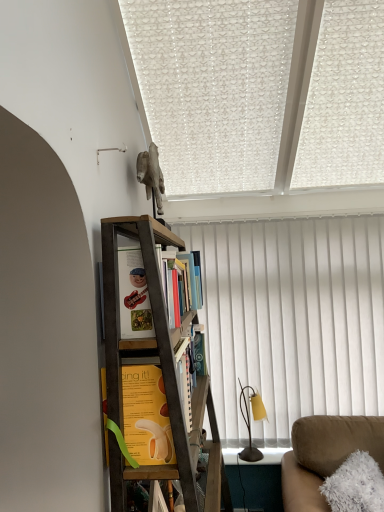
In order to face suede couch at lower right, should I rotate leftwards or rightwards?

Turn right approximately 23.073 degrees to face it.

The height and width of the screenshot is (512, 384). What do you see at coordinates (142, 356) in the screenshot? I see `wooden bookcase at center` at bounding box center [142, 356].

What do you see at coordinates (249, 424) in the screenshot? The image size is (384, 512). I see `metallic yellow table lamp at right` at bounding box center [249, 424].

Find the location of `yellow paper at center, arranged as the first book when ordered from the bottom`. yellow paper at center, arranged as the first book when ordered from the bottom is located at coordinates (146, 416).

What is the approximate width of gray stone horse at upper center?

gray stone horse at upper center is 5.29 inches wide.

The image size is (384, 512). I want to click on white textured curtain at center, so click(292, 319).

Can you confirm if gray stone horse at upper center is positioned to the left of hardcover books at center, acting as the 2th book starting from the front?

Indeed, gray stone horse at upper center is positioned on the left side of hardcover books at center, acting as the 2th book starting from the front.

From a real-world perspective, is gray stone horse at upper center on hardcover books at center, the 1th book positioned from the top?

Yes, from a real-world perspective, gray stone horse at upper center is over hardcover books at center, the 1th book positioned from the top

Find the location of a particular element. The width and height of the screenshot is (384, 512). animal on the left of hardcover books at center, the 1th book positioned from the top is located at coordinates (151, 174).

Consider the image. Does gray stone horse at upper center have a smaller size compared to hardcover books at center, placed as the second book when sorted from bottom to top?

No, gray stone horse at upper center is not smaller than hardcover books at center, placed as the second book when sorted from bottom to top.

Considering the points (202, 397) and (152, 142), which point is in front, point (202, 397) or point (152, 142)?

The point (202, 397) is more forward.

Would you say wooden bookcase at center is outside gray stone horse at upper center?

Absolutely, wooden bookcase at center is external to gray stone horse at upper center.

Locate an element on the screen. The image size is (384, 512). animal located above the wooden bookcase at center (from a real-world perspective) is located at coordinates (151, 174).

From the image's perspective, which object appears higher, wooden bookcase at center or gray stone horse at upper center?

gray stone horse at upper center appears higher in the image.

Is wooden bookshelf at upper center in contact with suede couch at lower right?

No, wooden bookshelf at upper center is not making contact with suede couch at lower right.

From a real-world perspective, is wooden bookshelf at upper center on top of suede couch at lower right?

Yes, from a real-world perspective, wooden bookshelf at upper center is over suede couch at lower right

You are a GUI agent. You are given a task and a screenshot of the screen. Output one action in this format:
    pyautogui.click(x=<x>, y=<y>)
    Task: Click on the studio couch below the wooden bookshelf at upper center (from a real-world perspective)
    
    Given the screenshot: What is the action you would take?
    pyautogui.click(x=325, y=455)

Considering the relative positions of wooden bookshelf at upper center and suede couch at lower right in the image provided, is wooden bookshelf at upper center to the left of suede couch at lower right from the viewer's perspective?

Indeed, wooden bookshelf at upper center is positioned on the left side of suede couch at lower right.

Locate an element on the screen. Image resolution: width=384 pixels, height=512 pixels. animal in front of the metallic yellow table lamp at right is located at coordinates (151, 174).

Is metallic yellow table lamp at right positioned far away from gray stone horse at upper center?

Indeed, metallic yellow table lamp at right is not near gray stone horse at upper center.

Between metallic yellow table lamp at right and gray stone horse at upper center, which one has less height?

gray stone horse at upper center is shorter.

Considering the positions of objects metallic yellow table lamp at right and gray stone horse at upper center in the image provided, who is more to the right, metallic yellow table lamp at right or gray stone horse at upper center?

From the viewer's perspective, metallic yellow table lamp at right appears more on the right side.

Could you tell me if yellow paper at center, which is the 2th book in back-to-front order, is facing wooden bookcase at center?

Yes, yellow paper at center, which is the 2th book in back-to-front order, is facing wooden bookcase at center.

Is yellow paper at center, arranged as the first book when ordered from the bottom, not close to wooden bookcase at center?

No, yellow paper at center, arranged as the first book when ordered from the bottom, is not far away from wooden bookcase at center.

Would you say yellow paper at center, which appears as the first book when viewed from the front, is to the left or to the right of wooden bookcase at center in the picture?

yellow paper at center, which appears as the first book when viewed from the front, is positioned on wooden bookcase at center's left side.

The height and width of the screenshot is (512, 384). What are the coordinates of `book that appears behind the wooden bookshelf at upper center` in the screenshot? It's located at (192, 277).

Is hardcover books at center, acting as the 2th book starting from the front, located within wooden bookshelf at upper center?

No, hardcover books at center, acting as the 2th book starting from the front, is located outside of wooden bookshelf at upper center.

From the image's perspective, which is below, wooden bookshelf at upper center or hardcover books at center, the 1th book positioned from the top?

hardcover books at center, the 1th book positioned from the top, is shown below in the image.

Considering the sizes of objects wooden bookshelf at upper center and hardcover books at center, acting as the 2th book starting from the front, in the image provided, who is smaller, wooden bookshelf at upper center or hardcover books at center, acting as the 2th book starting from the front,?

wooden bookshelf at upper center.

From a real-world perspective, between wooden bookshelf at upper center and gray stone horse at upper center, who is vertically higher?

gray stone horse at upper center is physically above.

Find the location of a particular element. animal behind the wooden bookshelf at upper center is located at coordinates (151, 174).

From the image's perspective, is wooden bookshelf at upper center under gray stone horse at upper center?

Correct, wooden bookshelf at upper center appears lower than gray stone horse at upper center in the image.

From a real-world perspective, which book is the 1st one underneath the gray stone horse at upper center? Please provide its 2D coordinates.

[(192, 277)]

Locate an element on the screen. Image resolution: width=384 pixels, height=512 pixels. animal that is above the wooden bookcase at center (from the image's perspective) is located at coordinates (151, 174).

Looking at the image, which one is located further to wooden bookcase at center, white textured curtain at center or gray stone horse at upper center?

white textured curtain at center lies further to wooden bookcase at center than the other object.

Estimate the real-world distances between objects in this image. Which object is closer to yellow paper at center, which is the 2th book in back-to-front order, gray stone horse at upper center or wooden bookshelf at upper center?

Based on the image, wooden bookshelf at upper center appears to be nearer to yellow paper at center, which is the 2th book in back-to-front order.

When comparing their distances from hardcover books at center, placed as the second book when sorted from bottom to top, does gray stone horse at upper center or metallic yellow table lamp at right seem closer?

gray stone horse at upper center is positioned closer to the anchor hardcover books at center, placed as the second book when sorted from bottom to top.

Estimate the real-world distances between objects in this image. Which object is further from wooden bookshelf at upper center, wooden bookcase at center or yellow paper at center, arranged as the first book when ordered from the bottom?

yellow paper at center, arranged as the first book when ordered from the bottom, is further to wooden bookshelf at upper center.

Which object lies further to the anchor point suede couch at lower right, white textured curtain at center or gray stone horse at upper center?

gray stone horse at upper center.

Which object lies nearer to the anchor point metallic yellow table lamp at right, white textured curtain at center or wooden bookcase at center?

Based on the image, white textured curtain at center appears to be nearer to metallic yellow table lamp at right.

When comparing their distances from wooden bookshelf at upper center, does metallic yellow table lamp at right or yellow paper at center, which is counted as the second book, starting from the top, seem further?

Among the two, metallic yellow table lamp at right is located further to wooden bookshelf at upper center.

When comparing their distances from wooden bookshelf at upper center, does wooden bookcase at center or metallic yellow table lamp at right seem closer?

wooden bookcase at center lies closer to wooden bookshelf at upper center than the other object.

What are the coordinates of `shelf between gray stone horse at upper center and yellow paper at center, arranged as the first book when ordered from the bottom, in the up-down direction` in the screenshot? It's located at (144, 266).

Identify the location of animal between wooden bookcase at center and white textured curtain at center in the front-back direction. (151, 174).

Locate an element on the screen. book positioned between wooden bookshelf at upper center and metallic yellow table lamp at right from near to far is located at coordinates (192, 277).

The height and width of the screenshot is (512, 384). Identify the location of book between yellow paper at center, arranged as the first book when ordered from the bottom, and suede couch at lower right, in the horizontal direction. [x=192, y=277].